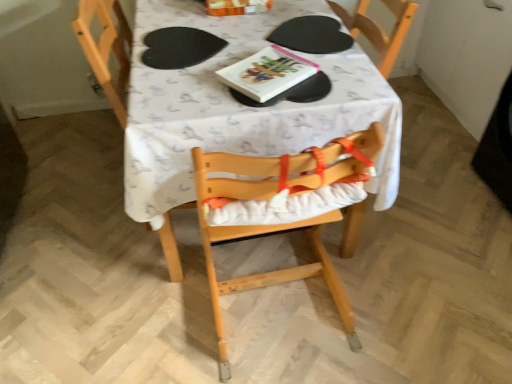
Question: Should I look upward or downward to see hardcover book at center?

Choices:
 (A) down
 (B) up

Answer: (B)

Question: From the image's perspective, is black matte paper plate at center under white fabric table at center?

Choices:
 (A) no
 (B) yes

Answer: (A)

Question: Is black matte paper plate at center oriented away from white fabric table at center?

Choices:
 (A) no
 (B) yes

Answer: (B)

Question: Can white fabric table at center be found inside black matte paper plate at center?

Choices:
 (A) no
 (B) yes

Answer: (A)

Question: Is black matte paper plate at center thinner than white fabric table at center?

Choices:
 (A) yes
 (B) no

Answer: (A)

Question: Does black matte paper plate at center lie behind white fabric table at center?

Choices:
 (A) yes
 (B) no

Answer: (A)

Question: From the image's perspective, is black matte paper plate at center located above white fabric table at center?

Choices:
 (A) no
 (B) yes

Answer: (B)

Question: Does white fabric table at center have a larger size compared to hardcover book at center?

Choices:
 (A) yes
 (B) no

Answer: (A)

Question: Considering the relative positions of white fabric table at center and hardcover book at center in the image provided, is white fabric table at center behind hardcover book at center?

Choices:
 (A) no
 (B) yes

Answer: (A)

Question: Can you confirm if white fabric table at center is shorter than hardcover book at center?

Choices:
 (A) no
 (B) yes

Answer: (A)

Question: Does white fabric table at center have a lesser width compared to hardcover book at center?

Choices:
 (A) yes
 (B) no

Answer: (B)

Question: Does white fabric table at center have a smaller size compared to hardcover book at center?

Choices:
 (A) no
 (B) yes

Answer: (A)

Question: From the image's perspective, is white fabric table at center on top of hardcover book at center?

Choices:
 (A) yes
 (B) no

Answer: (B)

Question: Can you confirm if black matte paper plate at center is taller than hardcover book at center?

Choices:
 (A) no
 (B) yes

Answer: (A)